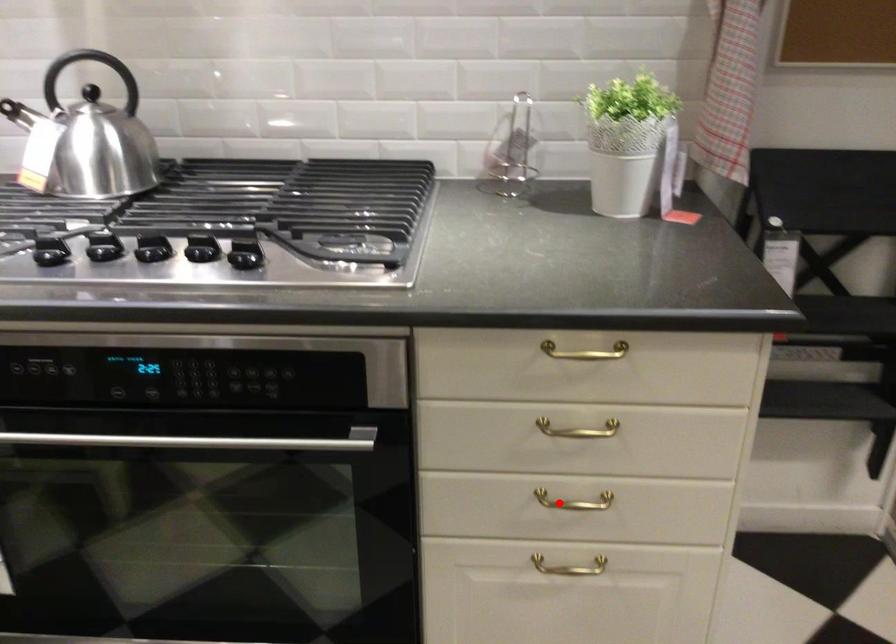
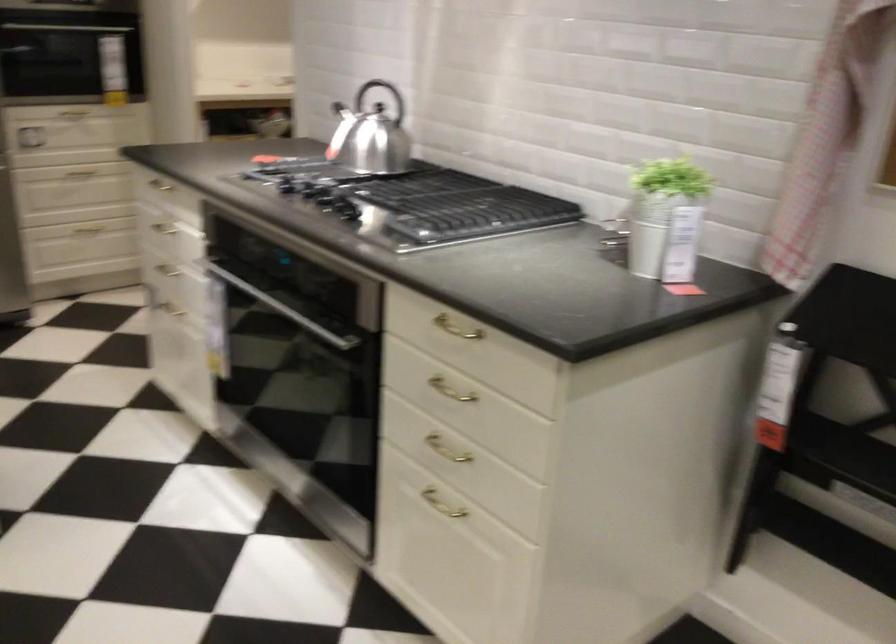
Question: I am providing you with two images of the same scene from different viewpoints. Given a red point in image1, look at the same physical point in image2. Is it:

Choices:
 (A) Closer to the viewpoint
 (B) Farther from the viewpoint

Answer: (B)